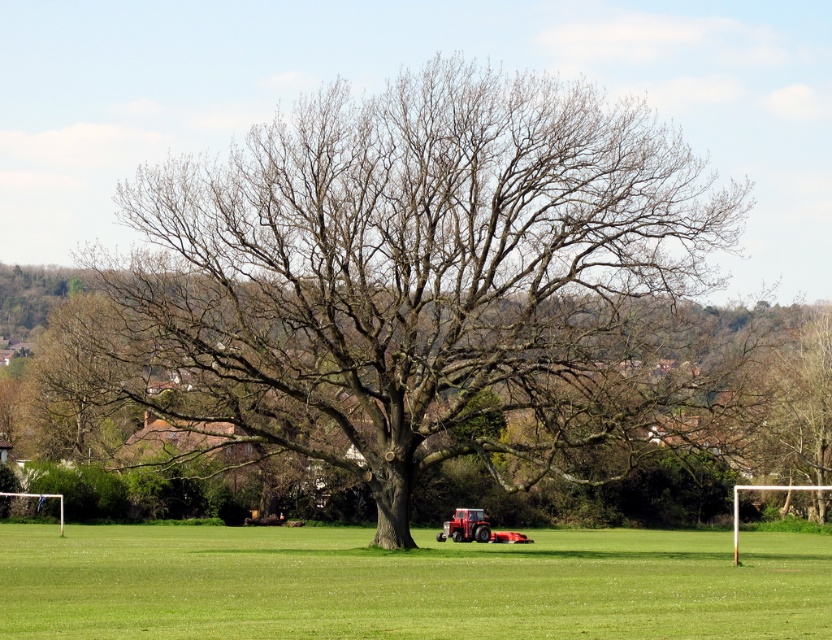
Between bare branches at center and green grass at center, which one has less height?

With less height is green grass at center.

Is bare branches at center behind green grass at center?

Yes, it is.

Find the location of a particular element. bare branches at center is located at coordinates (417, 282).